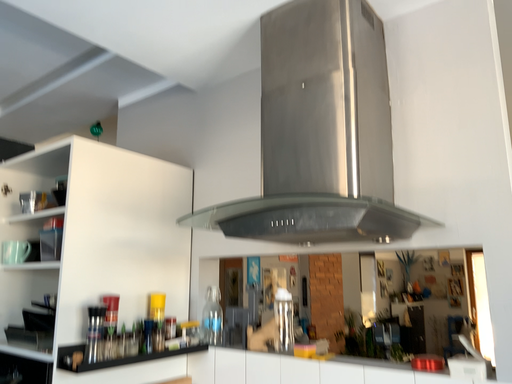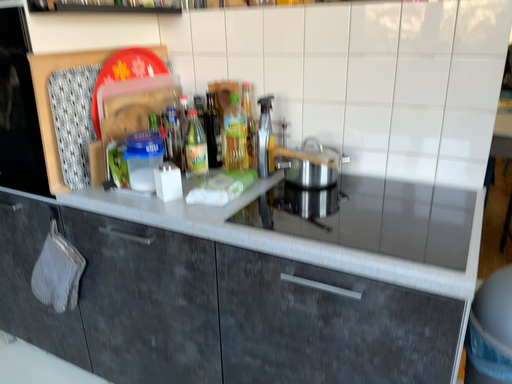
Question: Which way did the camera rotate in the video?

Choices:
 (A) rotated downward
 (B) rotated upward

Answer: (A)